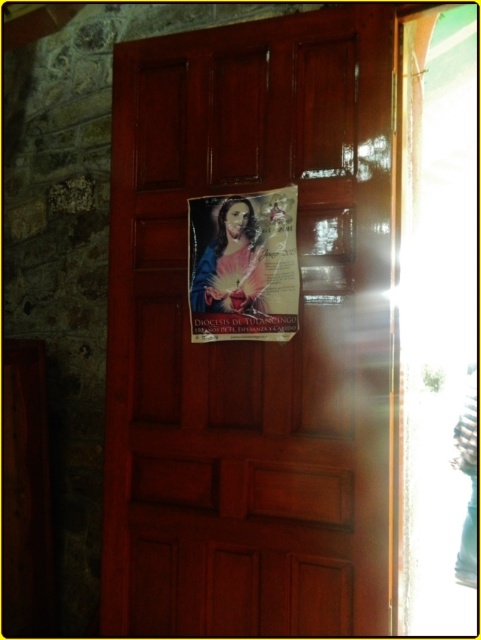
Between wooden door at center and matte paper poster at center, which one is positioned higher?

matte paper poster at center is above.

This screenshot has width=481, height=640. Find the location of `wooden door at center`. wooden door at center is located at coordinates (250, 340).

Describe the element at coordinates (250, 340) in the screenshot. The image size is (481, 640). I see `wooden door at center` at that location.

This screenshot has height=640, width=481. In order to click on wooden door at center in this screenshot , I will do `click(250, 340)`.